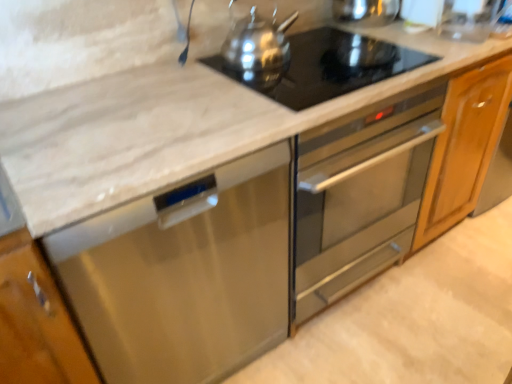
The image size is (512, 384). Identify the location of free space above stainless steel dishwasher at lower left (from a real-world perspective). (128, 118).